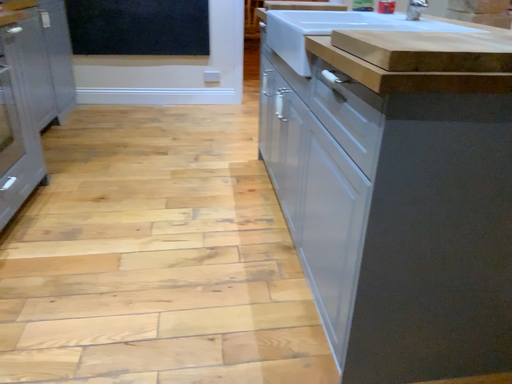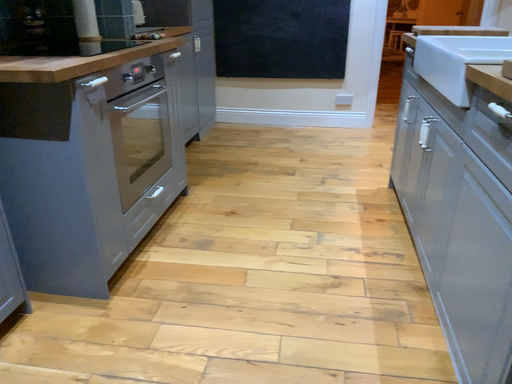
Question: Which way did the camera rotate in the video?

Choices:
 (A) rotated left
 (B) rotated right

Answer: (A)